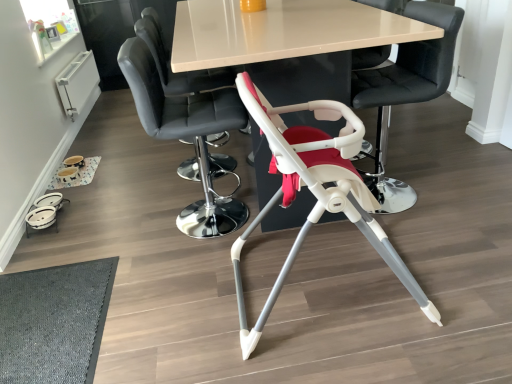
You are a GUI agent. You are given a task and a screenshot of the screen. Output one action in this format:
    pyautogui.click(x=<x>, y=<y>)
    Task: Click on the free spot in front of white plastic highchair at center, acting as the fourth chair starting from the left
    
    Given the screenshot: What is the action you would take?
    pyautogui.click(x=433, y=233)